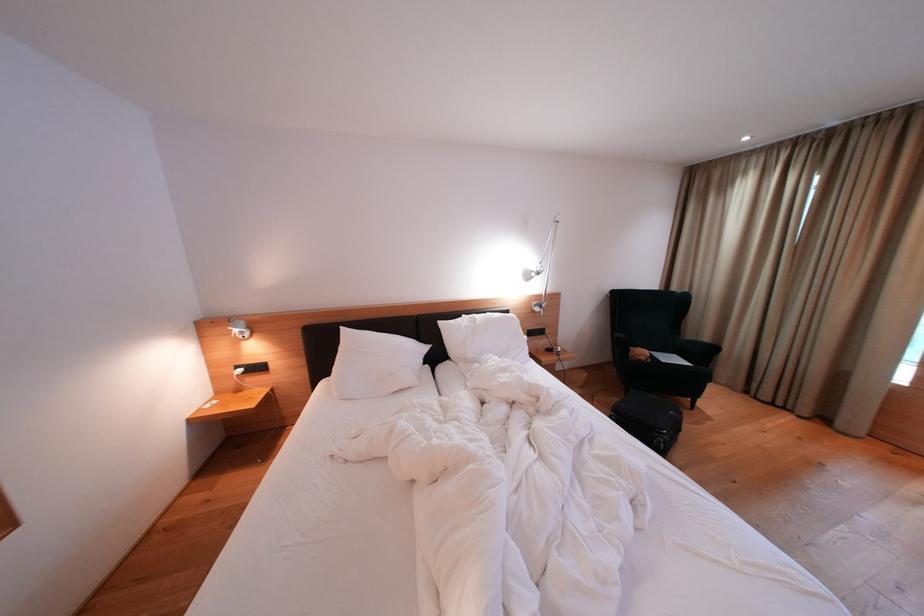
Find where to resting arm the chair armrest. Please return your answer as a coordinate pair (x, y).

(618, 342)